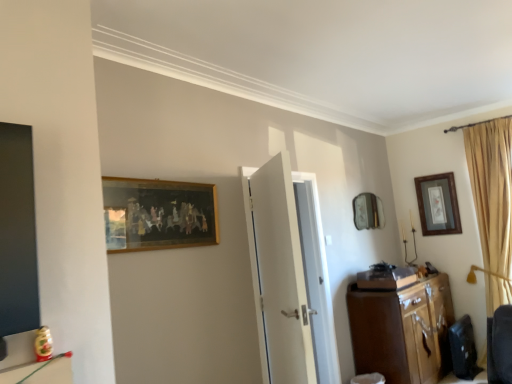
Where is `free space above wooden framed artwork at upper left, which is the first picture frame from left to right (from a real-world perspective)`? The height and width of the screenshot is (384, 512). free space above wooden framed artwork at upper left, which is the first picture frame from left to right (from a real-world perspective) is located at coordinates (157, 174).